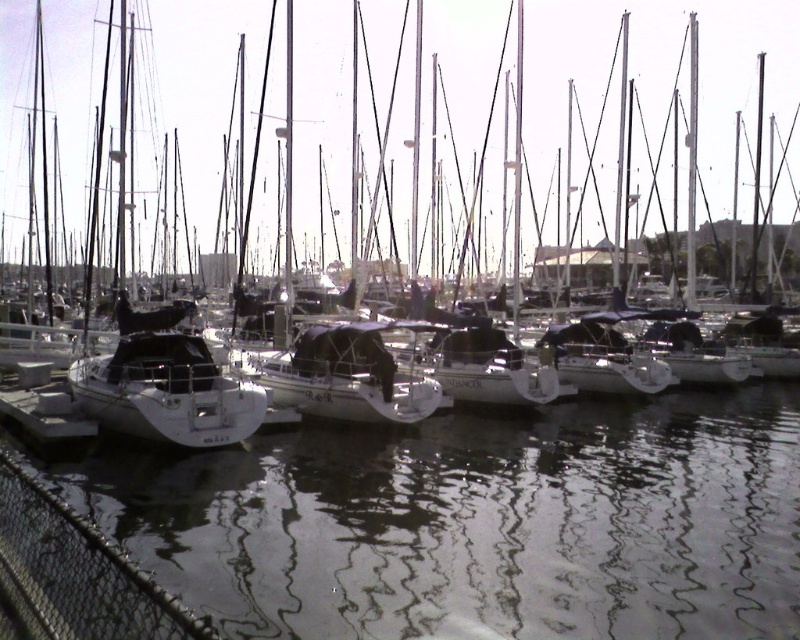
Question: Does clear water at center have a lesser width compared to white matte sailboat at left?

Choices:
 (A) yes
 (B) no

Answer: (A)

Question: Can you confirm if clear water at center is positioned above white matte sailboat at left?

Choices:
 (A) yes
 (B) no

Answer: (B)

Question: Is clear water at center below white matte sailboat at left?

Choices:
 (A) no
 (B) yes

Answer: (B)

Question: Which of the following is the closest to the observer?

Choices:
 (A) clear water at center
 (B) white matte sailboat at left

Answer: (A)

Question: Which point is farther to the camera?

Choices:
 (A) (674, 428)
 (B) (600, 188)

Answer: (B)